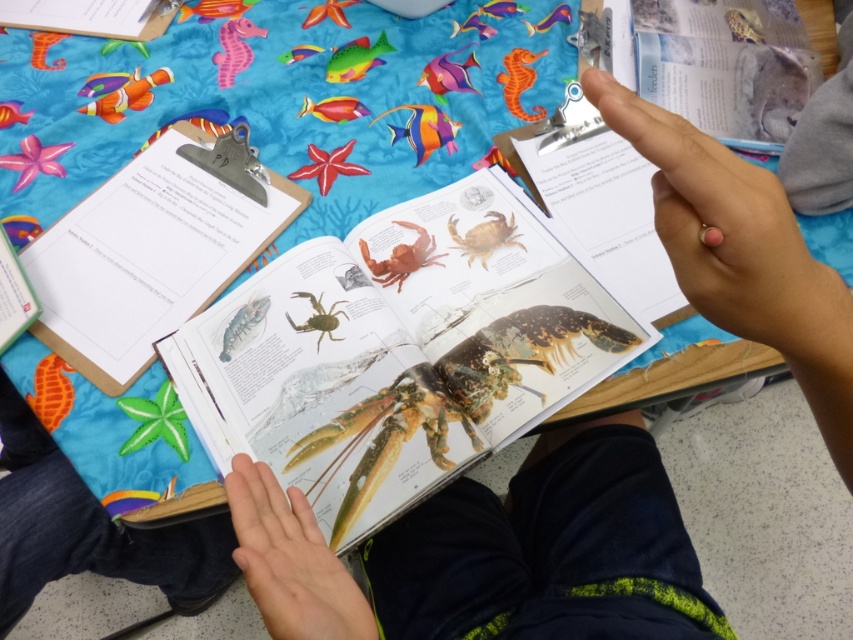
From the picture: Does matte gray seashell at upper right have a lesser height compared to metallic clip at upper center?

Incorrect, matte gray seashell at upper right's height does not fall short of metallic clip at upper center's.

Who is positioned more to the right, matte gray seashell at upper right or metallic clip at upper center?

matte gray seashell at upper right

Which is in front, point (747, 97) or point (250, 154)?

Point (250, 154) is more forward.

Where is `matte gray seashell at upper right`? This screenshot has width=853, height=640. matte gray seashell at upper right is located at coordinates (726, 65).

Which is more to the right, shiny paper book at center or matte brown crab at center?

shiny paper book at center

Between shiny paper book at center and matte brown crab at center, which one is positioned lower?

shiny paper book at center

Does point (491, 365) come farther from viewer compared to point (393, 259)?

No, (491, 365) is in front of (393, 259).

This screenshot has height=640, width=853. I want to click on shiny paper book at center, so click(399, 356).

Who is shorter, shiny metallic lobster at center or metallic clip at upper center?

Standing shorter between the two is metallic clip at upper center.

Can you confirm if shiny metallic lobster at center is smaller than metallic clip at upper center?

Actually, shiny metallic lobster at center might be larger than metallic clip at upper center.

Locate an element on the screen. shiny metallic lobster at center is located at coordinates (450, 396).